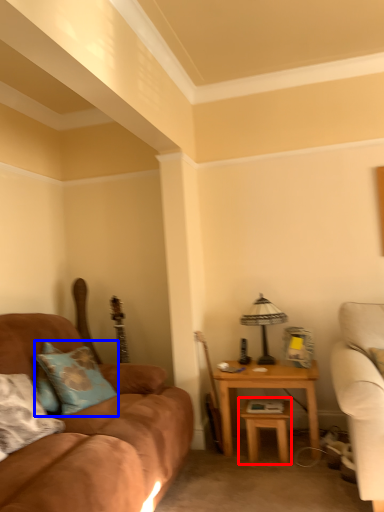
Question: Which object appears closest to the camera in this image, table (highlighted by a red box) or pillow (highlighted by a blue box)?

Choices:
 (A) table
 (B) pillow

Answer: (B)